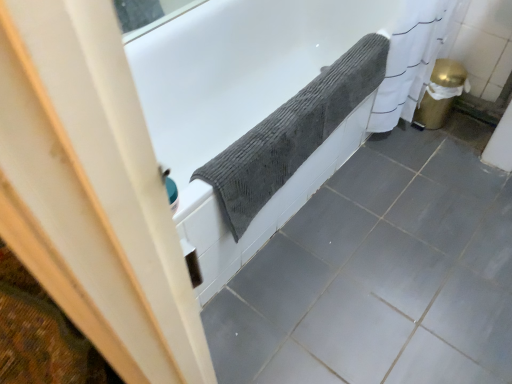
Where is `gray matte ceramic tile at lower center, which is the 2th ceramic tile in bottom-to-top order`? The height and width of the screenshot is (384, 512). gray matte ceramic tile at lower center, which is the 2th ceramic tile in bottom-to-top order is located at coordinates (494, 241).

Identify the location of gray textured towel at upper center. (291, 134).

Is gray textured towel at upper center looking in the opposite direction of gray textured towel at upper center?

No, gray textured towel at upper center is not at the back of gray textured towel at upper center.

In the image, there is a gray textured towel at upper center. Where is `bathtub below it (from a real-world perspective)`? The width and height of the screenshot is (512, 384). bathtub below it (from a real-world perspective) is located at coordinates (244, 104).

Does gray textured towel at upper center have a smaller size compared to gray textured towel at upper center?

No, gray textured towel at upper center is not smaller than gray textured towel at upper center.

From a real-world perspective, does gray textured towel at upper center sit lower than gray matte ceramic tile at lower center, positioned as the 1th ceramic tile in top-to-bottom order?

No, from a real-world perspective, gray textured towel at upper center is not beneath gray matte ceramic tile at lower center, positioned as the 1th ceramic tile in top-to-bottom order.

Does gray textured towel at upper center have a lesser width compared to gray matte ceramic tile at lower center, positioned as the 1th ceramic tile in top-to-bottom order?

No, gray textured towel at upper center is not thinner than gray matte ceramic tile at lower center, positioned as the 1th ceramic tile in top-to-bottom order.

Is gray textured towel at upper center taller or shorter than gray matte ceramic tile at lower center, positioned as the 1th ceramic tile in top-to-bottom order?

gray textured towel at upper center is taller than gray matte ceramic tile at lower center, positioned as the 1th ceramic tile in top-to-bottom order.

Is gray textured towel at upper center positioned with its back to gray matte ceramic tile at lower center, positioned as the 1th ceramic tile in top-to-bottom order?

gray textured towel at upper center is not turned away from gray matte ceramic tile at lower center, positioned as the 1th ceramic tile in top-to-bottom order.

Does gray matte ceramic tile at lower center, positioned as the 1th ceramic tile in top-to-bottom order, appear on the right side of textured gray towel at upper center, the 1th ceramic tile ordered from the bottom?

Yes.

From a real-world perspective, does gray matte ceramic tile at lower center, which is the 2th ceramic tile in bottom-to-top order, sit lower than textured gray towel at upper center, the 1th ceramic tile ordered from the bottom?

Actually, gray matte ceramic tile at lower center, which is the 2th ceramic tile in bottom-to-top order, is physically above textured gray towel at upper center, the 1th ceramic tile ordered from the bottom, in the real world.

Is gray matte ceramic tile at lower center, positioned as the 1th ceramic tile in top-to-bottom order, outside of textured gray towel at upper center, positioned as the second ceramic tile in top-to-bottom order?

No, gray matte ceramic tile at lower center, positioned as the 1th ceramic tile in top-to-bottom order, is inside textured gray towel at upper center, positioned as the second ceramic tile in top-to-bottom order,'s boundary.

Considering the positions of objects gray matte ceramic tile at lower center, positioned as the 1th ceramic tile in top-to-bottom order, and gray textured towel at upper center in the image provided, who is more to the right, gray matte ceramic tile at lower center, positioned as the 1th ceramic tile in top-to-bottom order, or gray textured towel at upper center?

Positioned to the right is gray matte ceramic tile at lower center, positioned as the 1th ceramic tile in top-to-bottom order.

Is gray matte ceramic tile at lower center, positioned as the 1th ceramic tile in top-to-bottom order, shorter than gray textured towel at upper center?

Yes, gray matte ceramic tile at lower center, positioned as the 1th ceramic tile in top-to-bottom order, is shorter than gray textured towel at upper center.

In the scene shown: Is gray textured towel at upper center inside gray matte ceramic tile at lower center, positioned as the 1th ceramic tile in top-to-bottom order?

No, gray matte ceramic tile at lower center, positioned as the 1th ceramic tile in top-to-bottom order, does not contain gray textured towel at upper center.

Is gray matte ceramic tile at lower center, positioned as the 1th ceramic tile in top-to-bottom order, thinner than gray textured towel at upper center?

Yes, gray matte ceramic tile at lower center, positioned as the 1th ceramic tile in top-to-bottom order, is thinner than gray textured towel at upper center.

Between textured gray towel at upper center, positioned as the second ceramic tile in top-to-bottom order, and gray textured towel at upper center, which one has larger width?

With larger width is textured gray towel at upper center, positioned as the second ceramic tile in top-to-bottom order.

Locate an element on the screen. The width and height of the screenshot is (512, 384). the 1st ceramic tile counting from the right of the gray textured towel at upper center is located at coordinates (379, 276).

Who is bigger, textured gray towel at upper center, the 1th ceramic tile ordered from the bottom, or gray textured towel at upper center?

gray textured towel at upper center is bigger.

Looking at this image, which point is more distant from viewer, (424, 319) or (135, 46)?

The point (135, 46) is behind.

Does point (345, 24) appear closer or farther from the camera than point (370, 232)?

Point (345, 24) is positioned farther from the camera compared to point (370, 232).

Which of these two, gray textured towel at upper center or textured gray towel at upper center, the 1th ceramic tile ordered from the bottom, is smaller?

Smaller between the two is textured gray towel at upper center, the 1th ceramic tile ordered from the bottom.

Image resolution: width=512 pixels, height=384 pixels. What are the coordinates of `ceramic tile in front of the gray textured towel at upper center` in the screenshot? It's located at (379, 276).

From the picture: Relative to textured gray towel at upper center, the 1th ceramic tile ordered from the bottom, is gray textured towel at upper center in front or behind?

In the image, gray textured towel at upper center appears behind textured gray towel at upper center, the 1th ceramic tile ordered from the bottom.

From the image's perspective, relative to gray textured towel at upper center, is gray textured towel at upper center above or below?

gray textured towel at upper center is situated lower than gray textured towel at upper center in the image.

Is point (210, 179) positioned in front of point (251, 85)?

Yes, point (210, 179) is closer to viewer.

How distant is gray textured towel at upper center from gray textured towel at upper center?

gray textured towel at upper center is 20.54 inches away from gray textured towel at upper center.

Which is correct: gray textured towel at upper center is inside gray textured towel at upper center, or outside of it?

gray textured towel at upper center is located inside gray textured towel at upper center.

The image size is (512, 384). Identify the location of bath towel lying below the gray textured towel at upper center (from the image's perspective). (291, 134).

Identify the location of the 1st ceramic tile located beneath the gray textured towel at upper center (from a real-world perspective). (494, 241).

Estimate the real-world distances between objects in this image. Which object is closer to textured gray towel at upper center, positioned as the second ceramic tile in top-to-bottom order, gray textured towel at upper center or gray matte ceramic tile at lower center, which is the 2th ceramic tile in bottom-to-top order?

gray matte ceramic tile at lower center, which is the 2th ceramic tile in bottom-to-top order, lies closer to textured gray towel at upper center, positioned as the second ceramic tile in top-to-bottom order, than the other object.

From the image, which object appears to be nearer to gray textured towel at upper center, gray matte ceramic tile at lower center, which is the 2th ceramic tile in bottom-to-top order, or gray textured towel at upper center?

gray textured towel at upper center lies closer to gray textured towel at upper center than the other object.

Considering their positions, is textured gray towel at upper center, positioned as the second ceramic tile in top-to-bottom order, positioned closer to gray textured towel at upper center than gray textured towel at upper center?

textured gray towel at upper center, positioned as the second ceramic tile in top-to-bottom order, lies closer to gray textured towel at upper center than the other object.

When comparing their distances from gray matte ceramic tile at lower center, positioned as the 1th ceramic tile in top-to-bottom order, does gray textured towel at upper center or textured gray towel at upper center, the 1th ceramic tile ordered from the bottom, seem further?

The object further to gray matte ceramic tile at lower center, positioned as the 1th ceramic tile in top-to-bottom order, is gray textured towel at upper center.

When comparing their distances from textured gray towel at upper center, positioned as the second ceramic tile in top-to-bottom order, does gray textured towel at upper center or gray textured towel at upper center seem closer?

gray textured towel at upper center is positioned closer to the anchor textured gray towel at upper center, positioned as the second ceramic tile in top-to-bottom order.

Which object lies nearer to the anchor point gray matte ceramic tile at lower center, positioned as the 1th ceramic tile in top-to-bottom order, gray textured towel at upper center or gray textured towel at upper center?

gray textured towel at upper center is closer to gray matte ceramic tile at lower center, positioned as the 1th ceramic tile in top-to-bottom order.

Based on their spatial positions, is gray matte ceramic tile at lower center, positioned as the 1th ceramic tile in top-to-bottom order, or gray textured towel at upper center closer to textured gray towel at upper center, the 1th ceramic tile ordered from the bottom?

gray matte ceramic tile at lower center, positioned as the 1th ceramic tile in top-to-bottom order, is positioned closer to the anchor textured gray towel at upper center, the 1th ceramic tile ordered from the bottom.

Looking at this image, from the image, which object appears to be farther from textured gray towel at upper center, positioned as the second ceramic tile in top-to-bottom order, gray matte ceramic tile at lower center, positioned as the 1th ceramic tile in top-to-bottom order, or gray textured towel at upper center?

gray textured towel at upper center is further to textured gray towel at upper center, positioned as the second ceramic tile in top-to-bottom order.

You are a GUI agent. You are given a task and a screenshot of the screen. Output one action in this format:
    pyautogui.click(x=<x>, y=<y>)
    Task: Click on the bath towel situated between gray textured towel at upper center and gray matte ceramic tile at lower center, positioned as the 1th ceramic tile in top-to-bottom order, from left to right
    This screenshot has height=384, width=512.
    Given the screenshot: What is the action you would take?
    pyautogui.click(x=291, y=134)

The image size is (512, 384). Identify the location of bath towel that lies between gray textured towel at upper center and textured gray towel at upper center, the 1th ceramic tile ordered from the bottom, from top to bottom. (291, 134).

This screenshot has width=512, height=384. In order to click on ceramic tile between gray textured towel at upper center and gray matte ceramic tile at lower center, which is the 2th ceramic tile in bottom-to-top order, in the horizontal direction in this screenshot , I will do `click(379, 276)`.

You are a GUI agent. You are given a task and a screenshot of the screen. Output one action in this format:
    pyautogui.click(x=<x>, y=<y>)
    Task: Click on the ceramic tile between gray textured towel at upper center and gray matte ceramic tile at lower center, positioned as the 1th ceramic tile in top-to-bottom order
    
    Given the screenshot: What is the action you would take?
    (x=379, y=276)